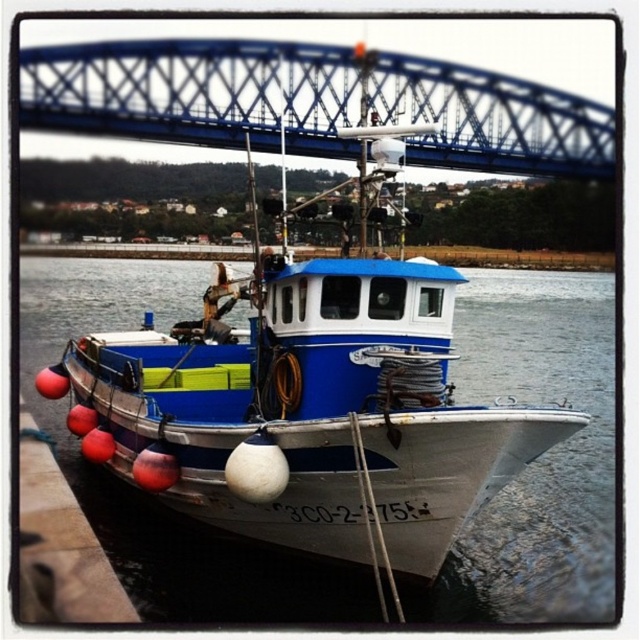
Looking at this image, you are a photographer planning to take a photo of the white matte boat at center and the blue metallic bridge at upper center. Based on their heights, which object should you focus on first to ensure both are fully captured in the frame?

The white matte boat at center is taller than the blue metallic bridge at upper center, so you should focus on the white matte boat at center first to ensure its full height is captured in the frame before adjusting for the bridge.

You are standing on the fishing boat and looking towards the point marked at coordinates (196, 92). What structure do you see in that direction?

The point marked at coordinates (196, 92) indicates the location of the blue metallic bridge at upper center, so you would see the blue metallic bridge at upper center in that direction.

You are a marine biologist planning to place a research buoy in the water near the white matte boat at center. According to the coordinates provided, where should you place the buoy to ensure it is closest to the boat?

The white matte boat at center is located at coordinates point (308,301), so placing the research buoy at those coordinates would ensure it is closest to the boat.